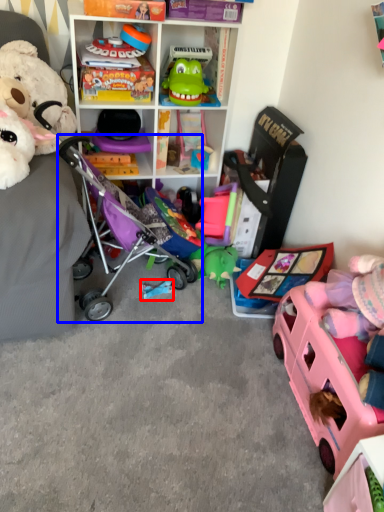
Question: Which point is further to the camera, toy (highlighted by a red box) or baby carriage (highlighted by a blue box)?

Choices:
 (A) toy
 (B) baby carriage

Answer: (A)